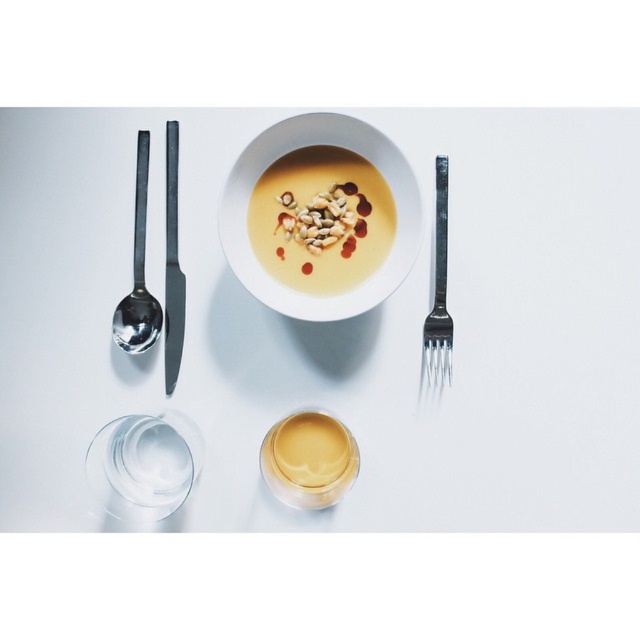
Based on the scene description, where is the white glossy bowl at center located in terms of coordinates?

The white glossy bowl at center is located at coordinates point [336,324].

You are a food stylist arranging utensils around the smooth creamy soup with nuts at center. If you want to place the silver metallic fork at right closer to the soup, would you move it to the left or the right?

To place the silver metallic fork at right closer to the smooth creamy soup with nuts at center, you would move it to the left since it is currently positioned to the right of the soup.

You are a food stylist arranging a minimalist dish. You have a yellow matte soup at center and a silver metallic fork at right. Which object takes up more space in the image?

The yellow matte soup at center takes up more space in the image because it is bigger than the silver metallic fork at right.